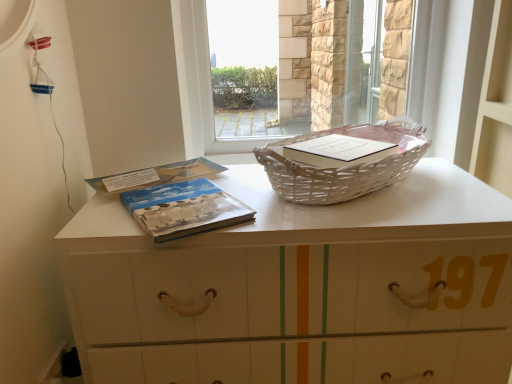
Locate an element on the screen. free space above white wicker basket at upper center (from a real-world perspective) is located at coordinates (220, 193).